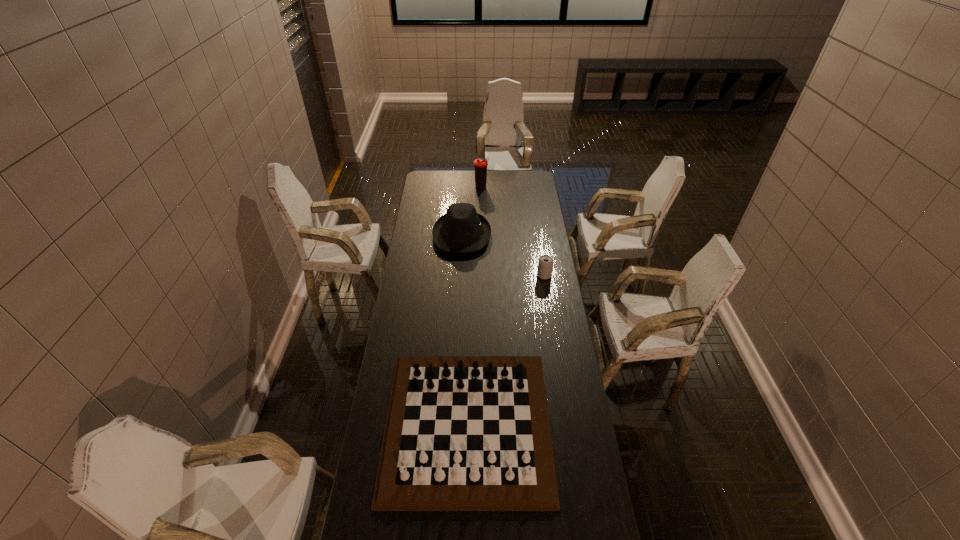
Find the location of `the farthest object`. the farthest object is located at coordinates (480, 164).

Find the location of a particular element. thermos bottle is located at coordinates (480, 164).

Where is `fedora`? fedora is located at coordinates (462, 229).

Image resolution: width=960 pixels, height=540 pixels. Find the location of `the third shortest object`. the third shortest object is located at coordinates (462, 229).

What are the coordinates of `the rightmost object` in the screenshot? It's located at (545, 264).

At what (x,y) coordinates should I click in order to perform the action: click on can. Please return your answer as a coordinate pair (x, y). Looking at the image, I should click on (545, 264).

Identify the location of gameboard. This screenshot has height=540, width=960. (463, 433).

The height and width of the screenshot is (540, 960). I want to click on vacant area situated 0.170m on the back of the farthest object, so click(481, 170).

Locate an element on the screen. free location located on the front-facing side of the fedora is located at coordinates (528, 235).

You are a GUI agent. You are given a task and a screenshot of the screen. Output one action in this format:
    pyautogui.click(x=<x>, y=<y>)
    Task: Click on the vacant region located 0.070m on the left of the third farthest object
    This screenshot has height=540, width=960.
    Given the screenshot: What is the action you would take?
    pyautogui.click(x=522, y=275)